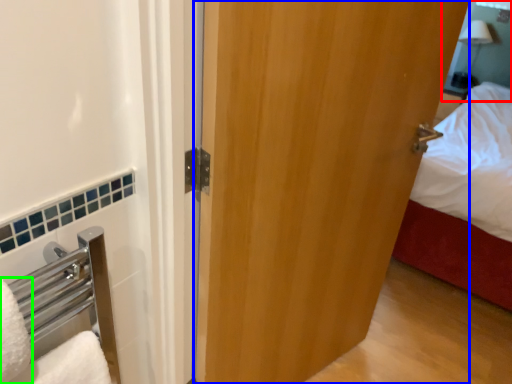
Question: Which object is positioned closest to mirror (highlighted by a red box)? Select from door (highlighted by a blue box) and bath towel (highlighted by a green box).

Choices:
 (A) door
 (B) bath towel

Answer: (A)